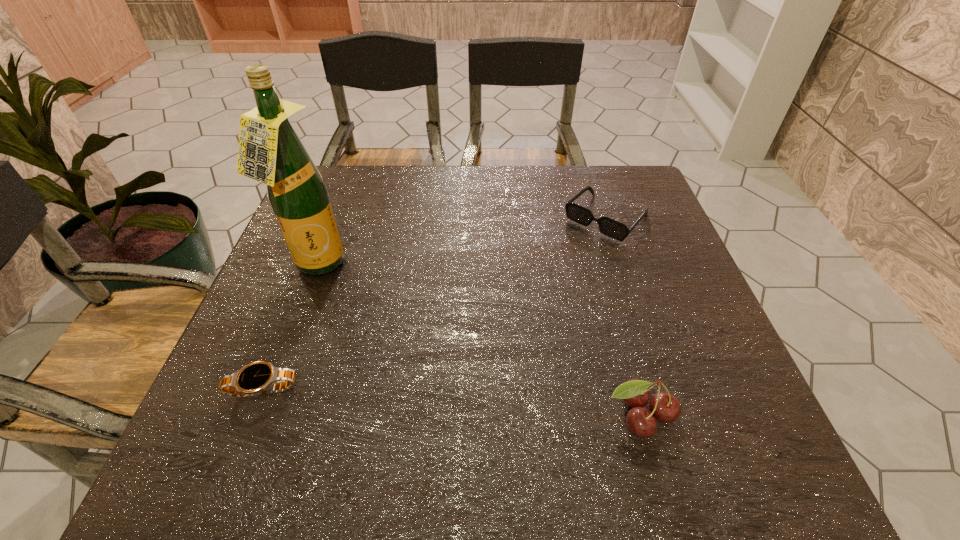
The width and height of the screenshot is (960, 540). In order to click on the shortest object in this screenshot , I will do `click(260, 377)`.

This screenshot has width=960, height=540. Find the location of `the second tallest object`. the second tallest object is located at coordinates (665, 407).

The image size is (960, 540). Find the location of `the tallest object`. the tallest object is located at coordinates (270, 151).

Find the location of a particular element. the second shortest object is located at coordinates (607, 226).

Locate an element on the screen. vacant space situated 0.350m on the right of the watch is located at coordinates (490, 389).

Where is `vacant region located 0.080m on the front-facing side of the liquor`? The width and height of the screenshot is (960, 540). vacant region located 0.080m on the front-facing side of the liquor is located at coordinates [349, 302].

You are a GUI agent. You are given a task and a screenshot of the screen. Output one action in this format:
    pyautogui.click(x=<x>, y=<y>)
    Task: Click on the vacant area situated 0.310m on the front-facing side of the liquor
    
    Given the screenshot: What is the action you would take?
    [414, 368]

At what (x,y) coordinates should I click in order to perform the action: click on free space located on the front-facing side of the liquor. Please return your answer as a coordinate pair (x, y). Image resolution: width=960 pixels, height=540 pixels. Looking at the image, I should click on (378, 332).

Identify the location of free space located on the front-facing side of the sunglasses. (566, 258).

Find the location of a particular element. This screenshot has width=960, height=540. vacant space located 0.160m on the front-facing side of the sunglasses is located at coordinates (551, 274).